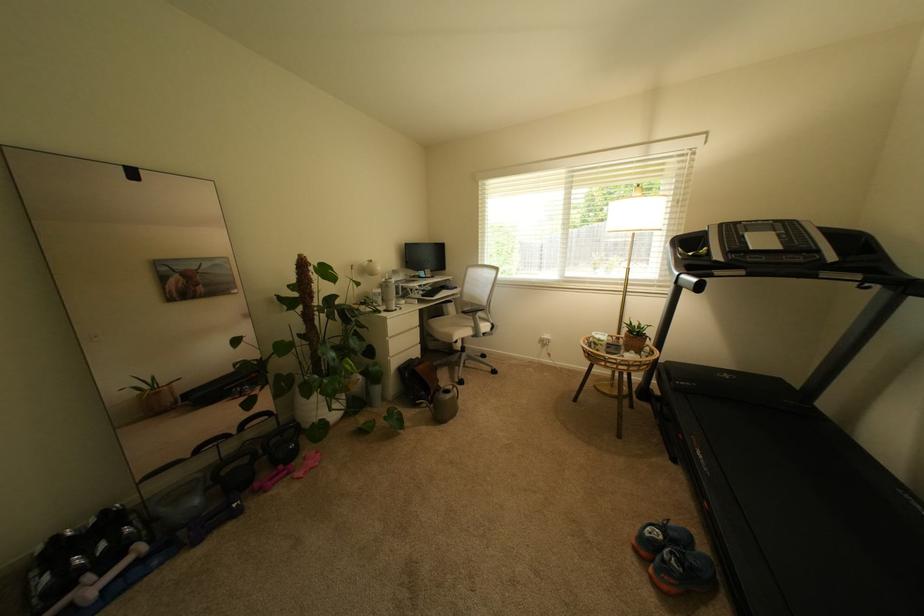
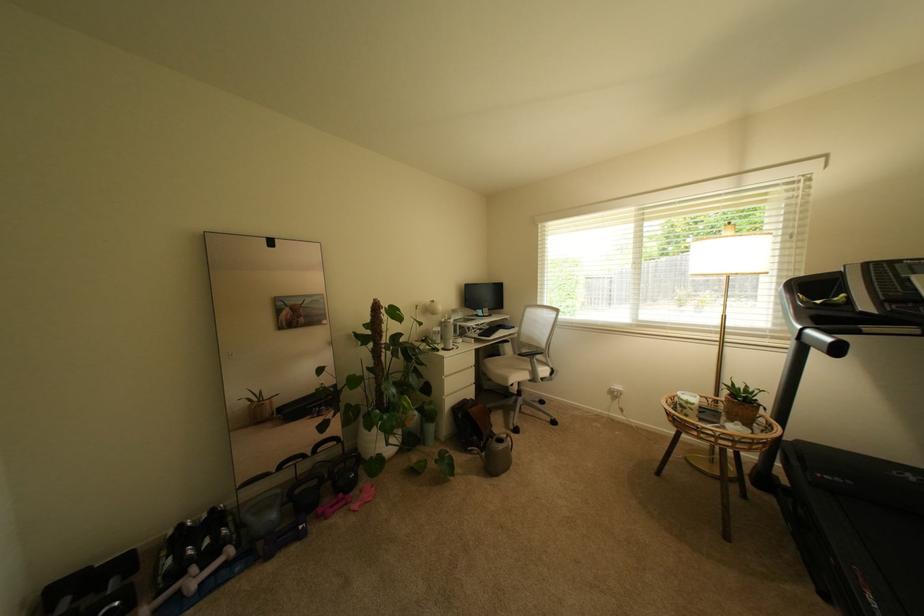
Find the pixel in the second image that matches pixel 552 338 in the first image.

(622, 389)